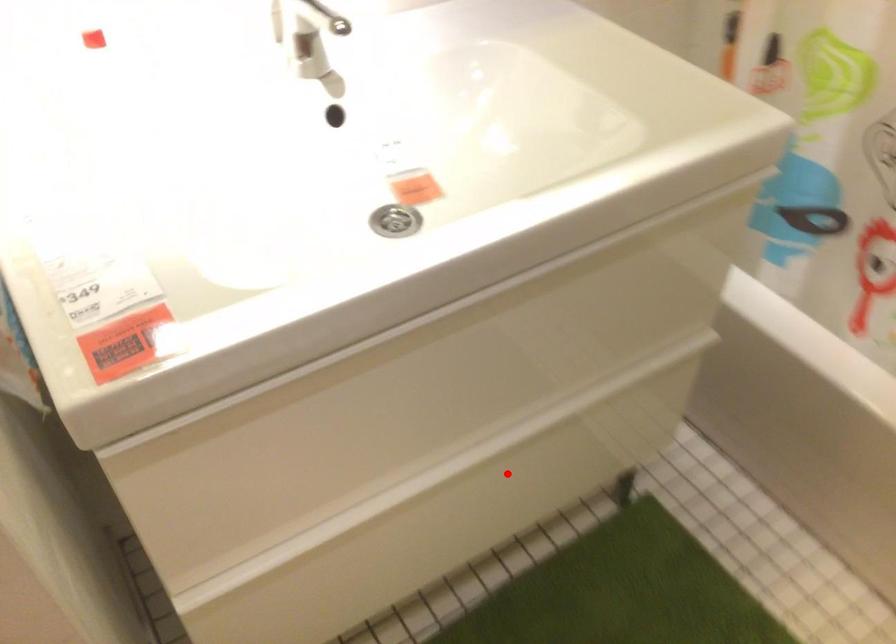
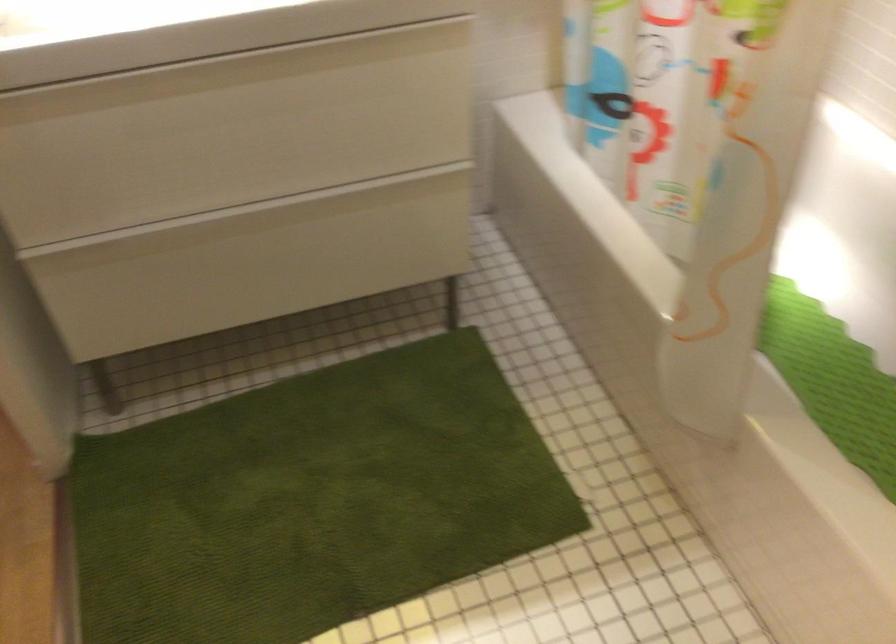
Question: I am providing you with two images of the same scene from different viewpoints. Given a red point in image1, look at the same physical point in image2. Is it:

Choices:
 (A) Closer to the viewpoint
 (B) Farther from the viewpoint

Answer: (B)